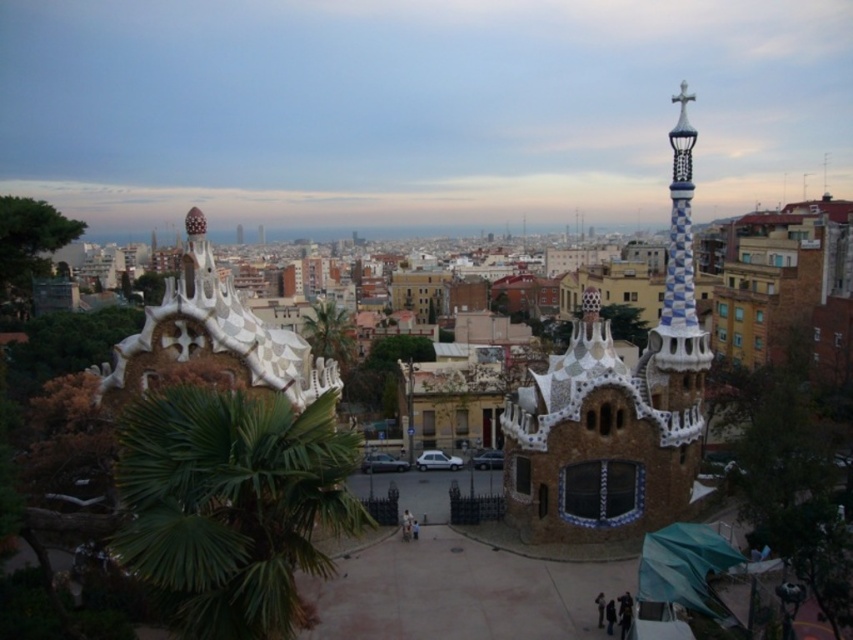
You are standing at the base of the cityscape and want to walk towards the entrance of the architectural structure. Which green leafy palm should you pass first, the green leafy palm at lower left or the green leafy palm tree at center?

The green leafy palm at lower left is below green leafy palm tree at center, so you will pass the green leafy palm at lower left first as you walk towards the entrance.

You are a landscape architect designing a garden path that winds around both the green leafy palm at lower left and the green leafy palm tree at center. Which palm requires a wider path to accommodate its size?

The green leafy palm tree at center requires a wider path since it occupies more space than the green leafy palm at lower left.